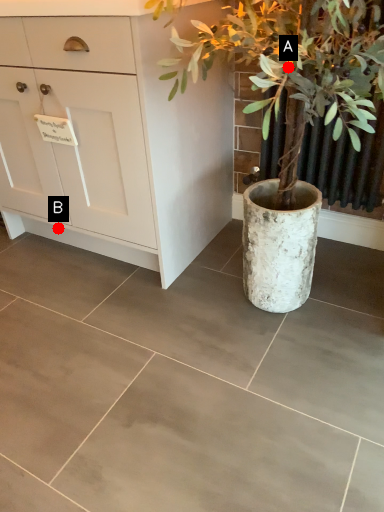
Question: Two points are circled on the image, labeled by A and B beside each circle. Among these points, which one is farthest from the camera?

Choices:
 (A) A is further
 (B) B is further

Answer: (B)